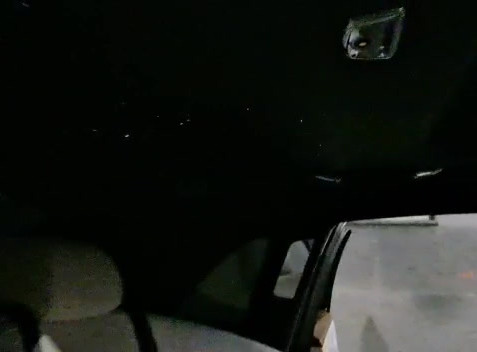
This screenshot has width=477, height=352. Find the location of `rod`. rod is located at coordinates (47, 342).